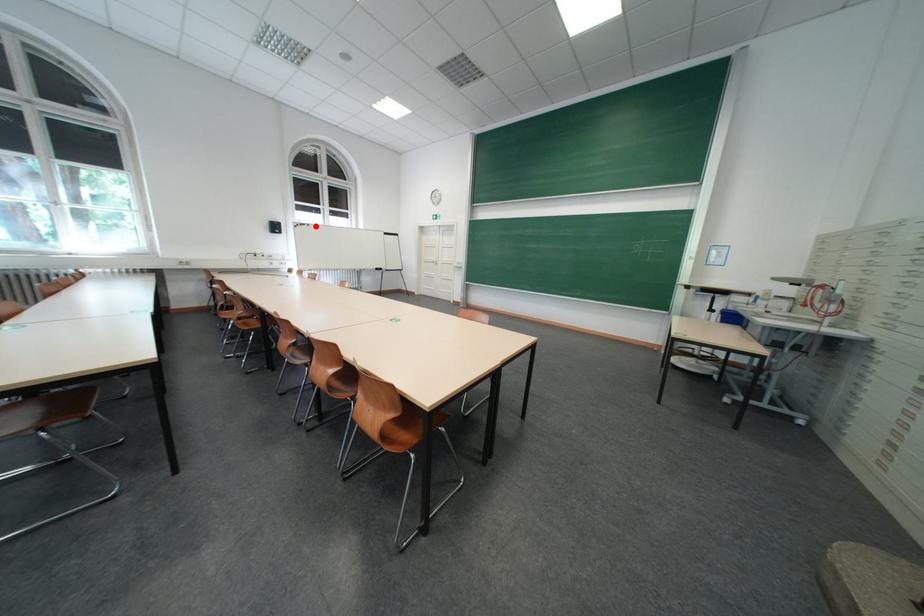
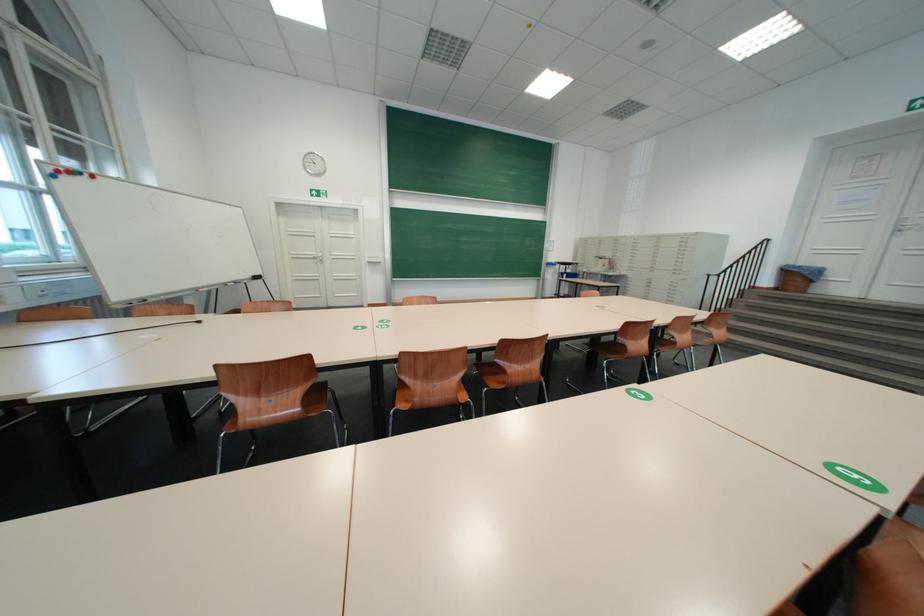
Where in the second image is the point corresponding to the highlighted location from the first image?

(88, 175)